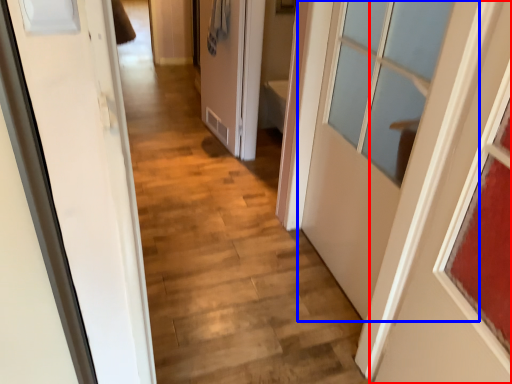
Question: Which point is closer to the camera, door (highlighted by a red box) or door (highlighted by a blue box)?

Choices:
 (A) door
 (B) door

Answer: (A)